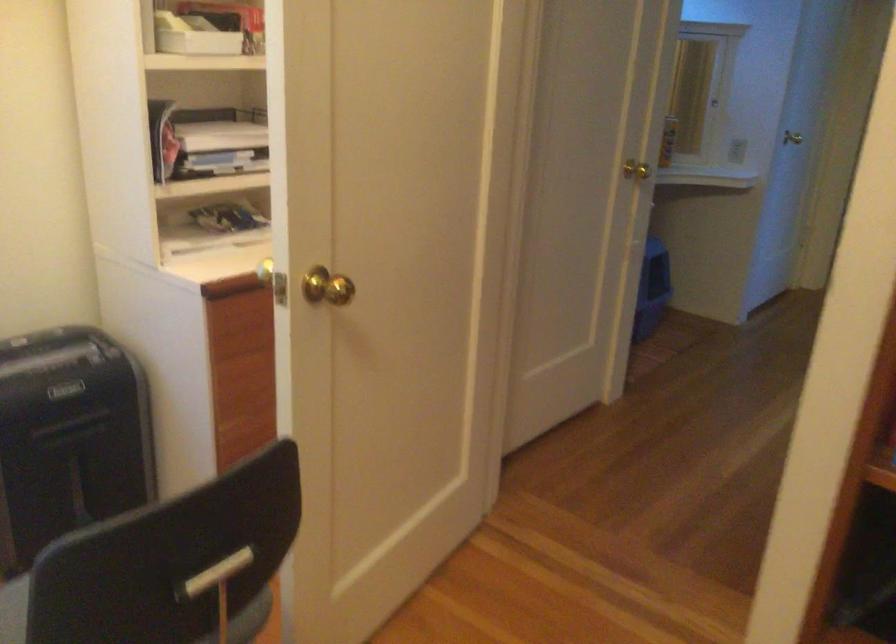
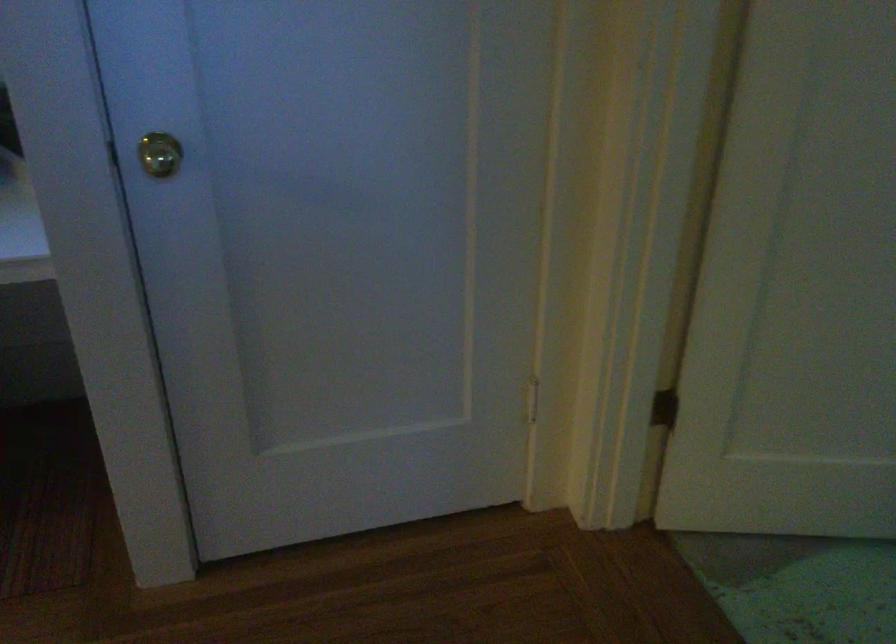
Find the pixel in the second image that matches [794,124] in the first image.

(159, 154)